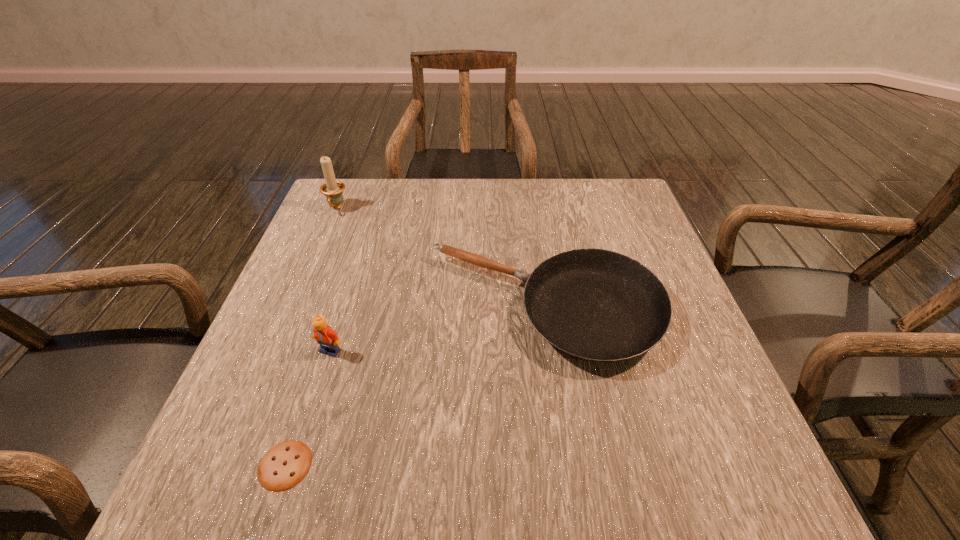
The width and height of the screenshot is (960, 540). In order to click on the leftmost object in this screenshot , I will do `click(332, 189)`.

You are a GUI agent. You are given a task and a screenshot of the screen. Output one action in this format:
    pyautogui.click(x=<x>, y=<y>)
    Task: Click on the farthest object
    Image resolution: width=960 pixels, height=540 pixels.
    Given the screenshot: What is the action you would take?
    pyautogui.click(x=332, y=189)

I want to click on the second tallest object, so click(328, 339).

I want to click on the third tallest object, so click(599, 305).

Identify the location of the rightmost object. The height and width of the screenshot is (540, 960). (599, 305).

I want to click on the nearest object, so click(x=286, y=464).

Locate an element on the screen. cookie is located at coordinates (286, 464).

Locate an element on the screen. The height and width of the screenshot is (540, 960). free region located 0.120m on the handle side of the farthest object is located at coordinates (321, 245).

Identify the location of free location located on the front-facing side of the Lego. The width and height of the screenshot is (960, 540). (289, 485).

Where is `vacant position located 0.180m on the left of the third tallest object`? vacant position located 0.180m on the left of the third tallest object is located at coordinates (344, 308).